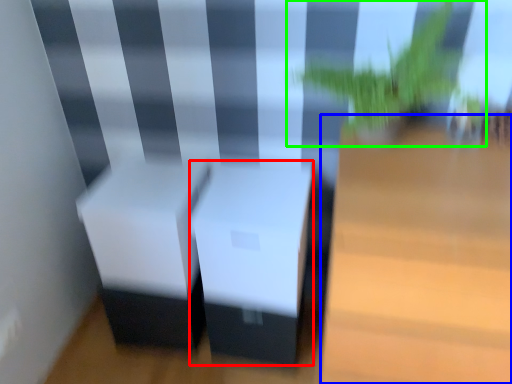
Question: Which object is the closest to the table (highlighted by a red box)? Choose among these: table (highlighted by a blue box) or houseplant (highlighted by a green box).

Choices:
 (A) table
 (B) houseplant

Answer: (A)